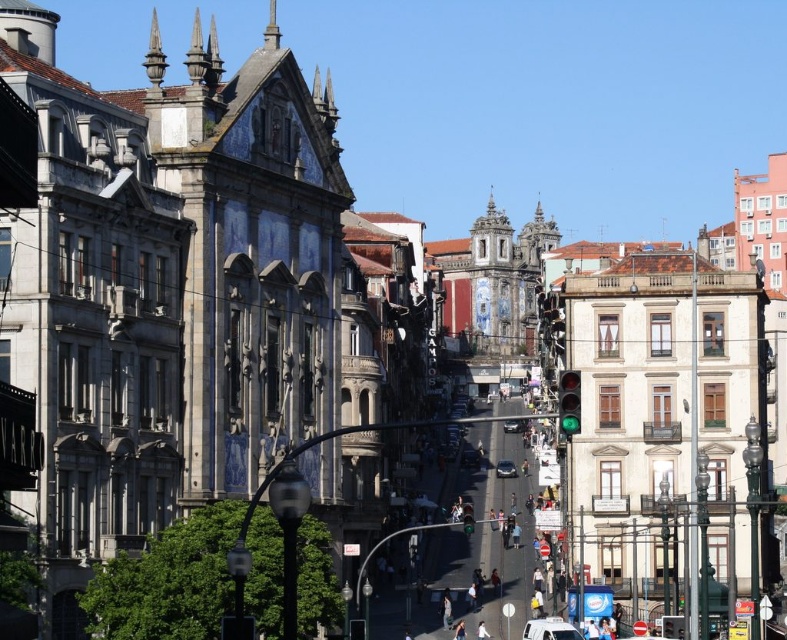
Question: Which of the following is the closest to the observer?

Choices:
 (A) (510, 474)
 (B) (519, 426)
 (C) (560, 625)

Answer: (C)

Question: Which point appears closest to the camera in this image?

Choices:
 (A) (497, 461)
 (B) (510, 433)
 (C) (545, 628)

Answer: (C)

Question: From the image, what is the correct spatial relationship of shiny silver sedan at center in relation to shiny silver car at center?

Choices:
 (A) right
 (B) left

Answer: (B)

Question: Can you confirm if shiny silver sedan at center is positioned to the right of shiny silver car at center?

Choices:
 (A) no
 (B) yes

Answer: (A)

Question: Does white matte car at center appear on the left side of shiny silver car at center?

Choices:
 (A) no
 (B) yes

Answer: (B)

Question: Which object appears farthest from the camera in this image?

Choices:
 (A) shiny silver car at center
 (B) shiny silver sedan at center
 (C) white matte car at center

Answer: (A)